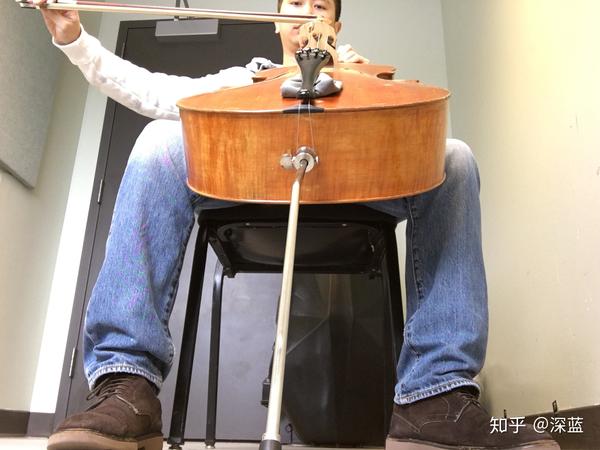
The width and height of the screenshot is (600, 450). What are the coordinates of `cello stand` in the screenshot? It's located at (270, 437).